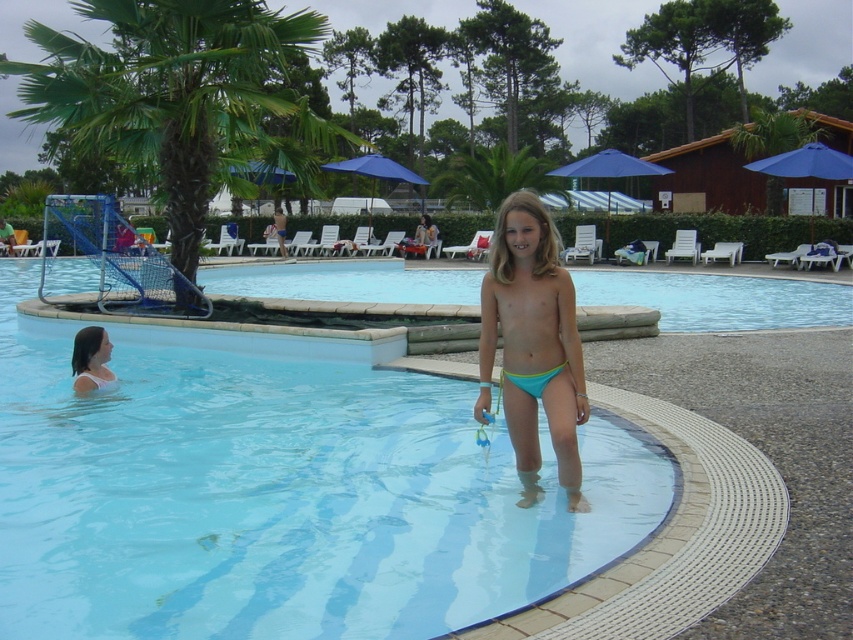
Question: Is clear blue water at center smaller than green leafy palm tree at upper center?

Choices:
 (A) yes
 (B) no

Answer: (A)

Question: Does clear plastic pool at center have a greater width compared to clear blue water at center?

Choices:
 (A) yes
 (B) no

Answer: (B)

Question: Does green leafy palm tree at left appear on the right side of neon green fabric bikini at center?

Choices:
 (A) yes
 (B) no

Answer: (B)

Question: Which object appears farthest from the camera in this image?

Choices:
 (A) white matte bikini at lower left
 (B) matte white hair at lower left
 (C) green leafy palm tree at left
 (D) neon green fabric bikini at center

Answer: (C)

Question: Which point is closer to the camera taking this photo?

Choices:
 (A) (108, 378)
 (B) (184, 168)
 (C) (96, 387)

Answer: (C)

Question: Which of the following is the farthest from the observer?

Choices:
 (A) matte white hair at lower left
 (B) green leafy palm tree at left
 (C) neon green fabric bikini at center
 (D) white matte bikini at lower left

Answer: (B)